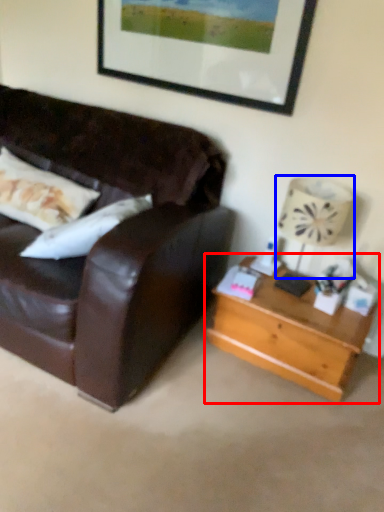
Question: Which of the following is the closest to the observer, table (highlighted by a red box) or lamp (highlighted by a blue box)?

Choices:
 (A) table
 (B) lamp

Answer: (B)